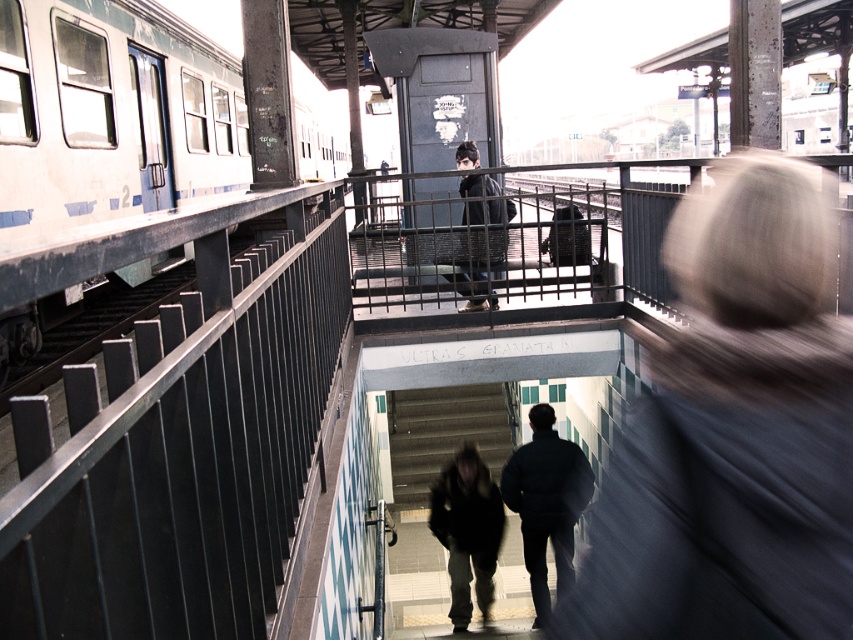
Can you confirm if black metal rail at left is positioned above dark blue jacket at center?

Yes.

In the scene shown: Does black metal rail at left appear under dark blue jacket at center?

No.

Is point (236, 520) closer to camera compared to point (524, 500)?

That is True.

I want to click on black metal rail at left, so click(x=186, y=454).

Is blurred gray hair at upper right wider than dark gray jacket at center?

No.

Can you confirm if blurred gray hair at upper right is positioned to the left of dark gray jacket at center?

Incorrect, blurred gray hair at upper right is not on the left side of dark gray jacket at center.

Does point (740, 563) lie behind point (459, 188)?

No, (740, 563) is in front of (459, 188).

Locate an element on the screen. blurred gray hair at upper right is located at coordinates coord(766,387).

In the scene shown: Can you confirm if dark blue jacket at center is smaller than dark brown leather jacket at center?

Incorrect, dark blue jacket at center is not smaller in size than dark brown leather jacket at center.

Is dark blue jacket at center below dark brown leather jacket at center?

Actually, dark blue jacket at center is above dark brown leather jacket at center.

Which is in front, point (552, 449) or point (477, 515)?

Point (552, 449) is in front.

Identify the location of dark blue jacket at center. Image resolution: width=853 pixels, height=640 pixels. (546, 502).